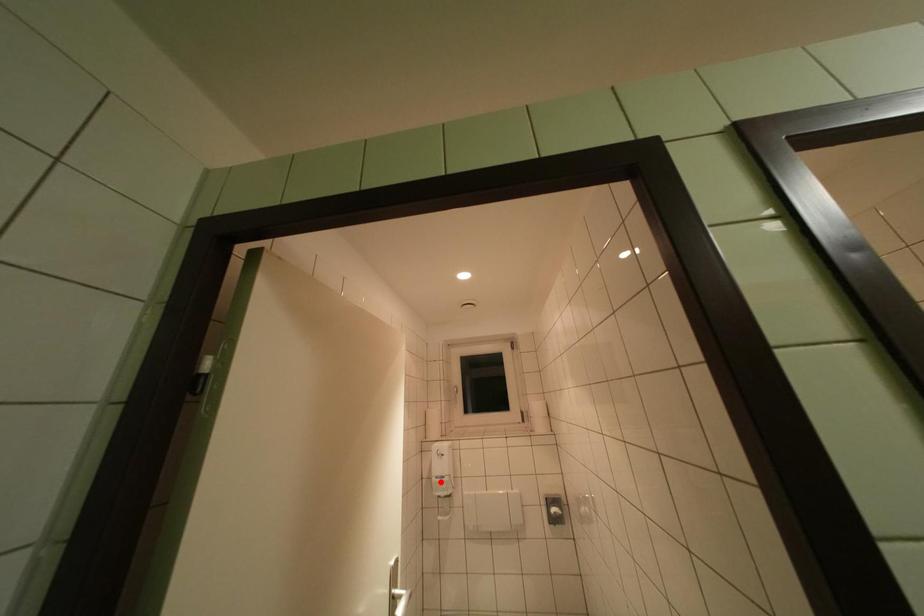
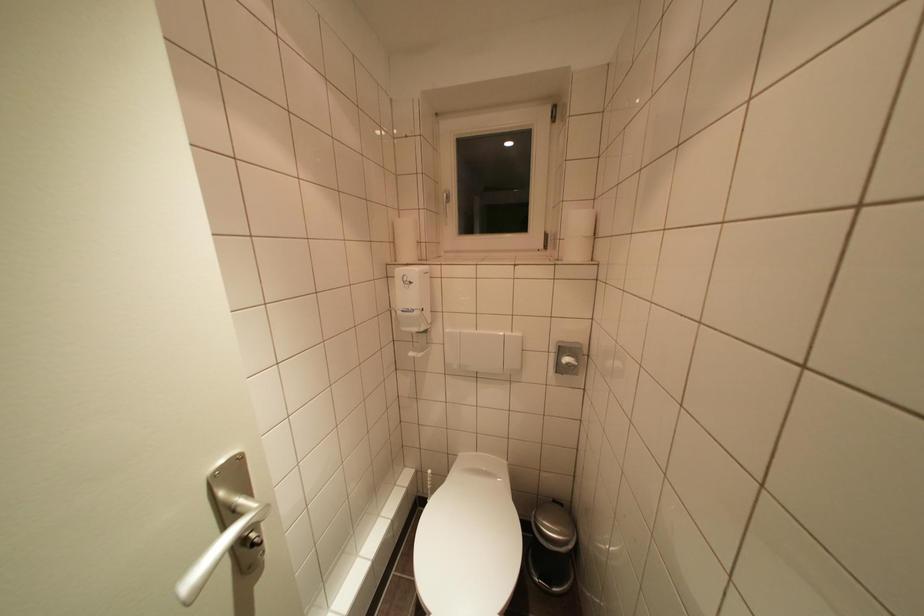
Question: A red point is marked in image1. In image2, is the corresponding 3D point closer to the camera or farther? Reply with the corresponding letter.

Choices:
 (A) The corresponding 3D point is closer.
 (B) The corresponding 3D point is farther.

Answer: (A)